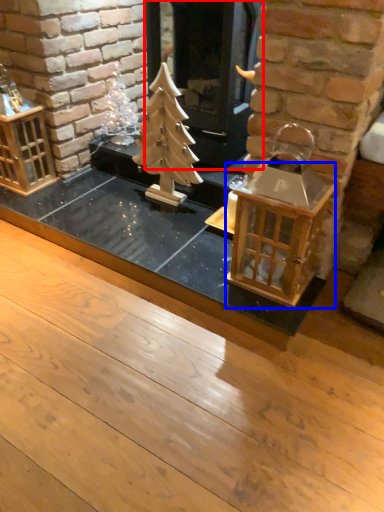
Question: Which object is further to the camera taking this photo, fireplace (highlighted by a red box) or table (highlighted by a blue box)?

Choices:
 (A) fireplace
 (B) table

Answer: (A)